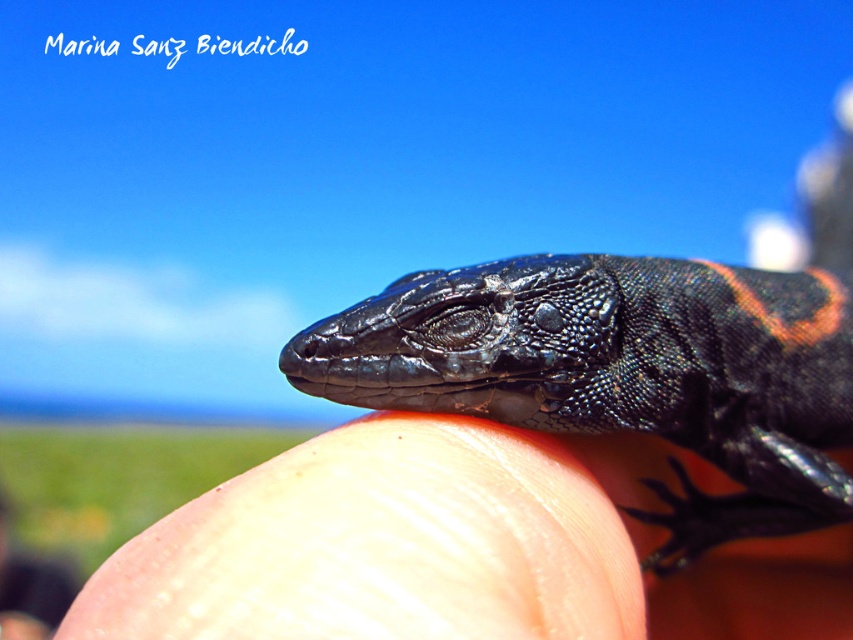
You are a biologist examining a lizard on a human finger. You need to compare the width of the shiny black lizard at center and the smooth skin at center. Which one is wider?

The shiny black lizard at center is wider than the smooth skin at center according to the description.

From the picture: You are a biologist observing a lizard on a human hand. Based on the image, which object is on top of the other between the shiny black lizard at center and the smooth skin at center?

The shiny black lizard at center is positioned over the smooth skin at center.